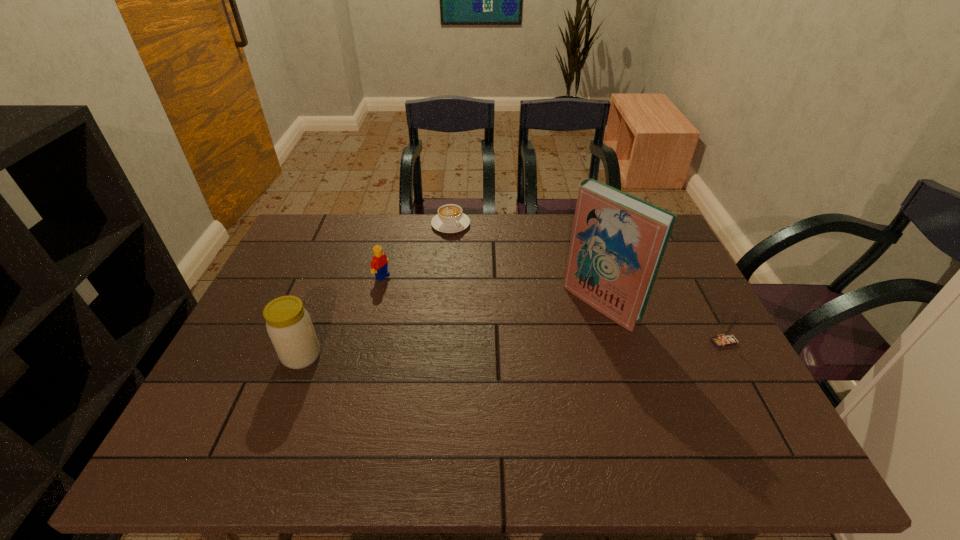
Identify the location of free space that satisfies the following two spatial constraints: 1. on the front side of the second object from right to left; 2. on the right side of the Lego. The width and height of the screenshot is (960, 540). (375, 303).